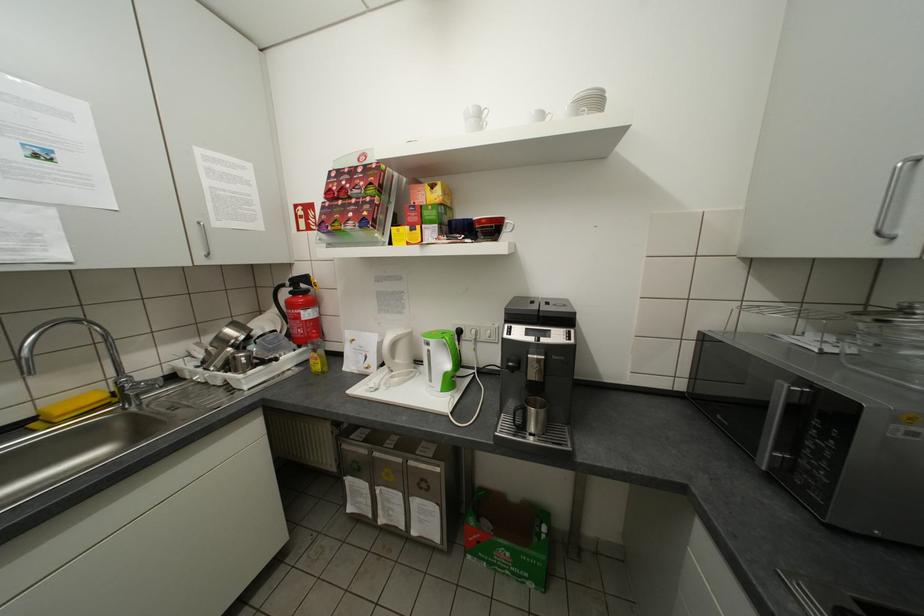
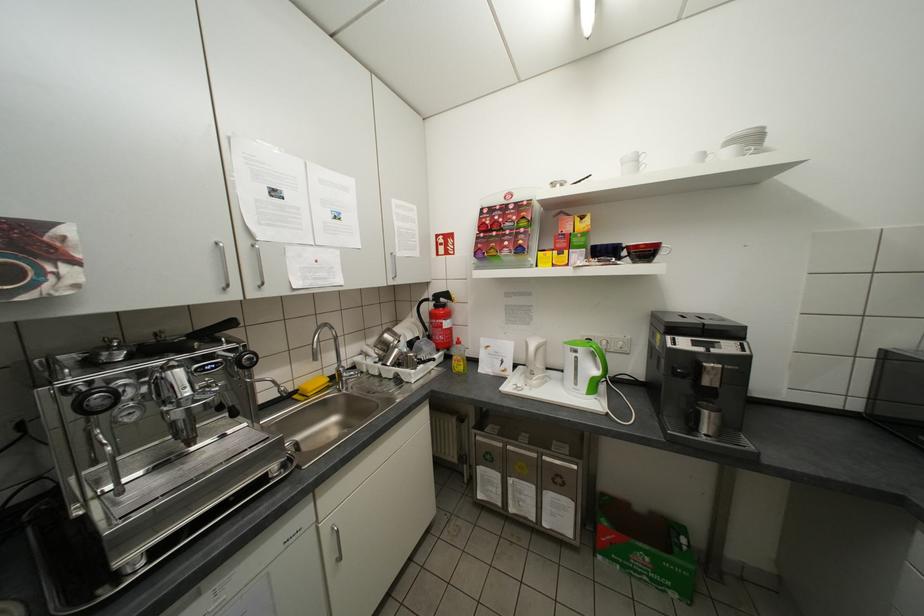
In the second image, find the point that corresponds to [544,357] in the first image.

(721, 365)